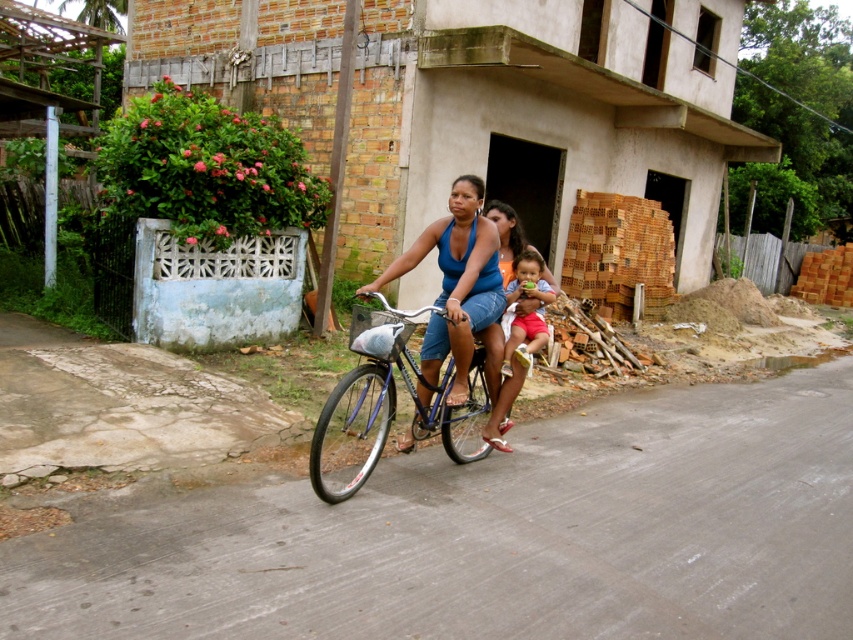
Question: Is blue fabric tank top at center further to camera compared to matte red shorts at center?

Choices:
 (A) no
 (B) yes

Answer: (A)

Question: Which point is closer to the camera?

Choices:
 (A) shiny blue bicycle at center
 (B) matte blue shorts at center

Answer: (A)

Question: Which object is positioned closest to the matte red shorts at center?

Choices:
 (A) blue fabric tank top at center
 (B) shiny blue bicycle at center

Answer: (A)

Question: Which point is farther to the camera?

Choices:
 (A) matte blue shorts at center
 (B) blue fabric tank top at center
 (C) shiny blue bicycle at center
 (D) matte red shorts at center

Answer: (D)

Question: Is shiny blue bicycle at center thinner than blue fabric tank top at center?

Choices:
 (A) no
 (B) yes

Answer: (A)

Question: Does matte blue shorts at center appear over matte red shorts at center?

Choices:
 (A) yes
 (B) no

Answer: (B)